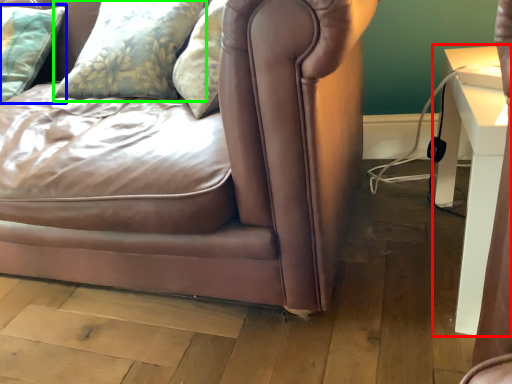
Question: Which is farther away from table (highlighted by a red box)? pillow (highlighted by a blue box) or pillow (highlighted by a green box)?

Choices:
 (A) pillow
 (B) pillow

Answer: (A)